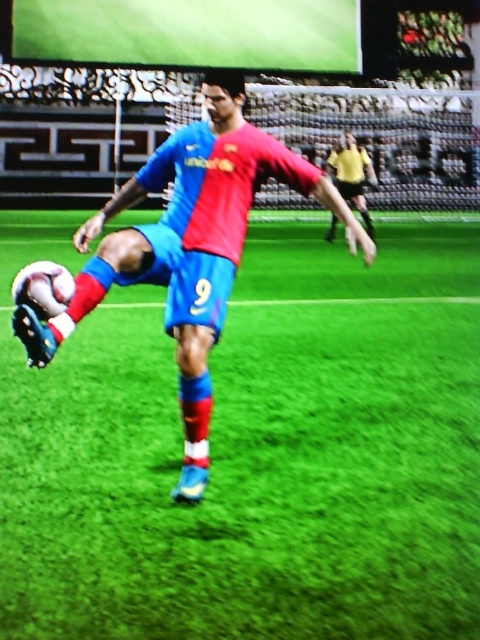
You are a soccer coach analyzing the field setup. The green artificial turf at center is where the ball is placed for a kickoff. Considering the shiny blue shorts at center, which belong to the player taking the kick, is the turf surface tall enough to potentially interfere with the player during the kickoff?

The green artificial turf at center is shorter than the shiny blue shorts at center, so it is unlikely to interfere with the player during the kickoff.

Looking at this image, you are a soccer coach analyzing a play from the image. You notice the green artificial turf at center and the shiny blue shorts at center. Which object is located below the other?

The green artificial turf at center is positioned under shiny blue shorts at center, so the green artificial turf at center is below the shiny blue shorts at center.